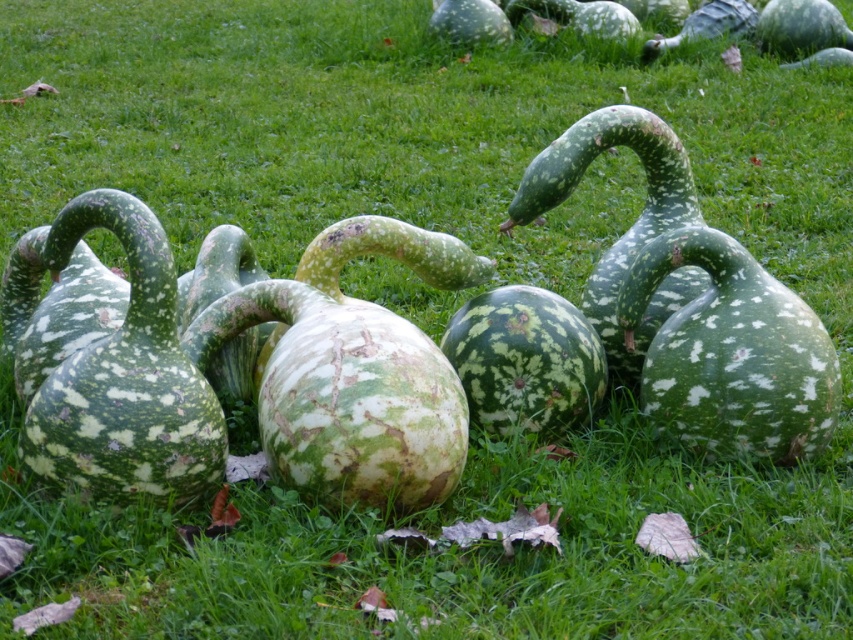
Looking at this image, you are standing in a field and want to pick up the speckled green gourd at left and the green spotted gourd at center. Which gourd should you reach for first to grab the closest one?

The speckled green gourd at left is closer to the viewer than the green spotted gourd at center, so you should reach for the speckled green gourd at left first.

Consider the image. You are arranging gourds for a fall display and have the speckled green gourd at left and the green spotted gourd at center. If you want to place a decorative pumpkin between them, where should you position it?

The decorative pumpkin should be placed between the speckled green gourd at left and the green spotted gourd at center, as the speckled green gourd at left is to the left of green spotted gourd at center.